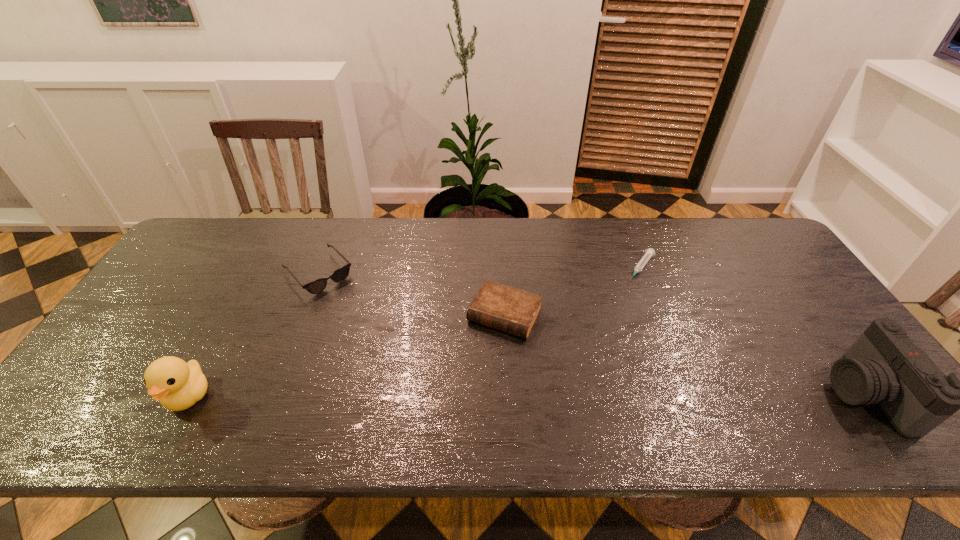
The height and width of the screenshot is (540, 960). I want to click on free spot located 0.390m at the needle end of the second object from right to left, so click(572, 367).

Locate an element on the screen. The width and height of the screenshot is (960, 540). vacant space situated at the needle end of the second object from right to left is located at coordinates pyautogui.click(x=628, y=290).

Locate an element on the screen. This screenshot has width=960, height=540. blank space located 0.090m on the spine side of the third object from left to right is located at coordinates (476, 366).

This screenshot has height=540, width=960. Identify the location of vacant space situated on the spine side of the third object from left to right. (471, 376).

Locate an element on the screen. Image resolution: width=960 pixels, height=540 pixels. blank space located 0.130m on the spine side of the third object from left to right is located at coordinates (469, 379).

Where is `vacant region located on the front lenses of the sunglasses`? Image resolution: width=960 pixels, height=540 pixels. vacant region located on the front lenses of the sunglasses is located at coordinates (379, 339).

Where is `free location located on the front lenses of the sunglasses`? This screenshot has height=540, width=960. free location located on the front lenses of the sunglasses is located at coordinates (355, 313).

The width and height of the screenshot is (960, 540). In order to click on free location located 0.060m on the front lenses of the sunglasses in this screenshot , I will do `click(347, 303)`.

The width and height of the screenshot is (960, 540). Find the location of `syringe present at the far edge`. syringe present at the far edge is located at coordinates (650, 252).

Find the location of a particular element. This screenshot has height=540, width=960. sunglasses positioned at the far edge is located at coordinates (316, 286).